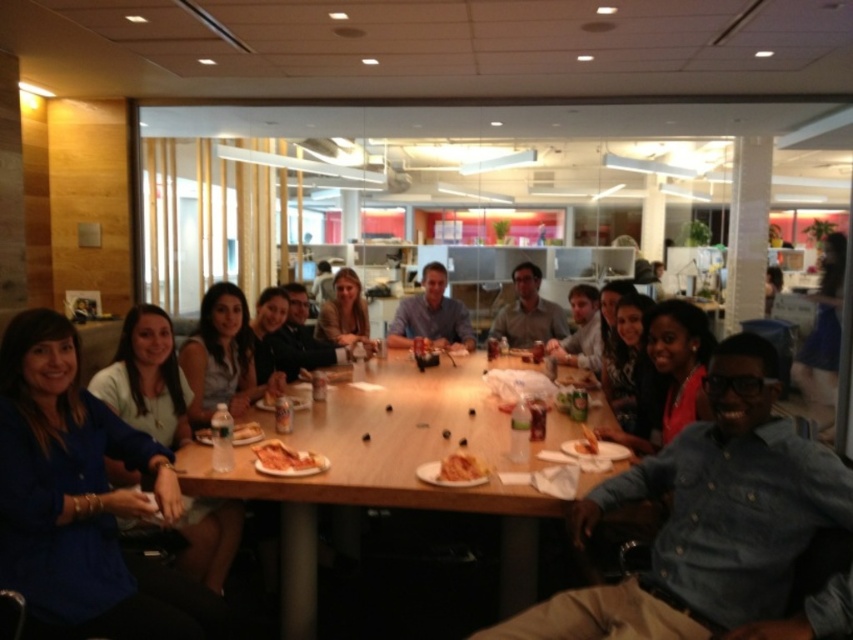
Question: Which object is positioned farthest from the wooden table at center?

Choices:
 (A) golden crispy pizza at center
 (B) blue shirt at center
 (C) golden crispy pastry at center

Answer: (B)

Question: Which point is farther from the camera taking this photo?

Choices:
 (A) (263, 468)
 (B) (817, 618)
 (C) (583, 449)

Answer: (C)

Question: Is golden crispy pizza at center to the left of golden crispy pastry at center from the viewer's perspective?

Choices:
 (A) yes
 (B) no

Answer: (A)

Question: Which is farther from the golden crispy fries at center?

Choices:
 (A) golden crispy pastry at center
 (B) denim shirt at center
 (C) golden crispy pizza at center
 (D) white paper plate at center

Answer: (D)

Question: Can you confirm if golden crispy pizza at center is positioned to the left of white paper plate at center?

Choices:
 (A) no
 (B) yes

Answer: (A)

Question: From the image, what is the correct spatial relationship of blue shirt at center in relation to golden crispy pastry at center?

Choices:
 (A) above
 (B) below

Answer: (A)